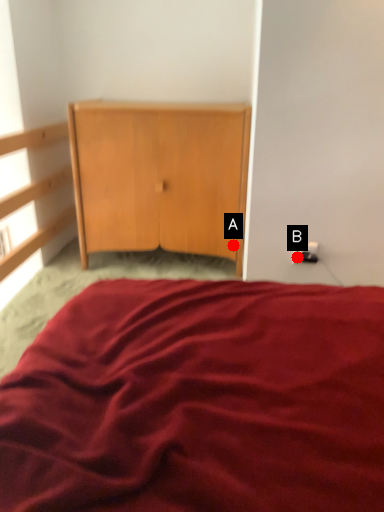
Question: Two points are circled on the image, labeled by A and B beside each circle. Which point is closer to the camera taking this photo?

Choices:
 (A) A is closer
 (B) B is closer

Answer: (B)